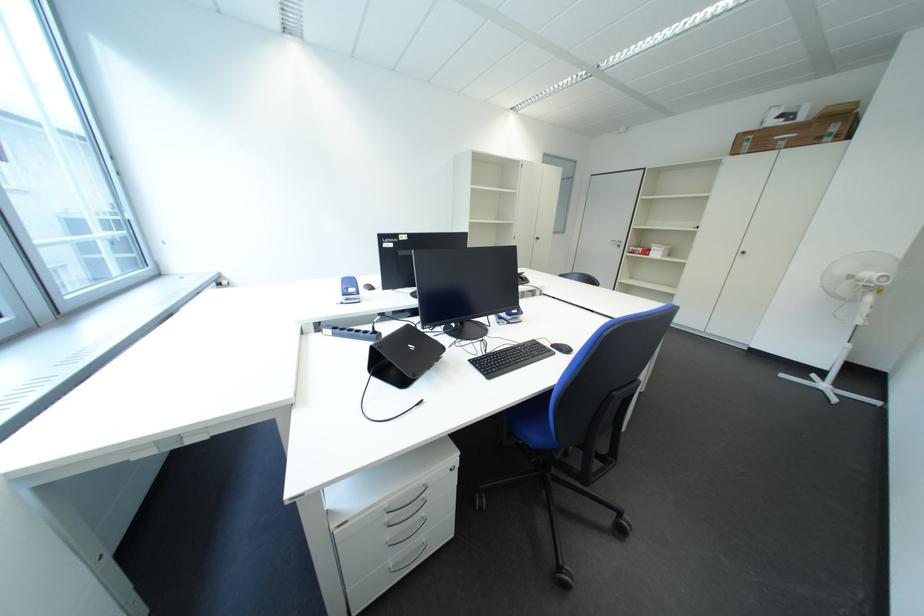
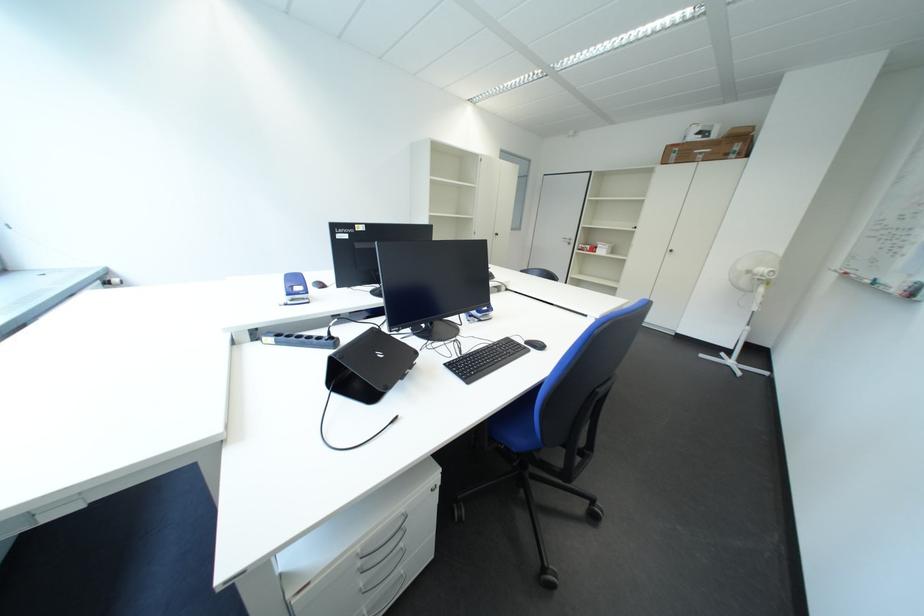
Locate, in the second image, the point that corresponds to [400,537] in the first image.

(374, 584)